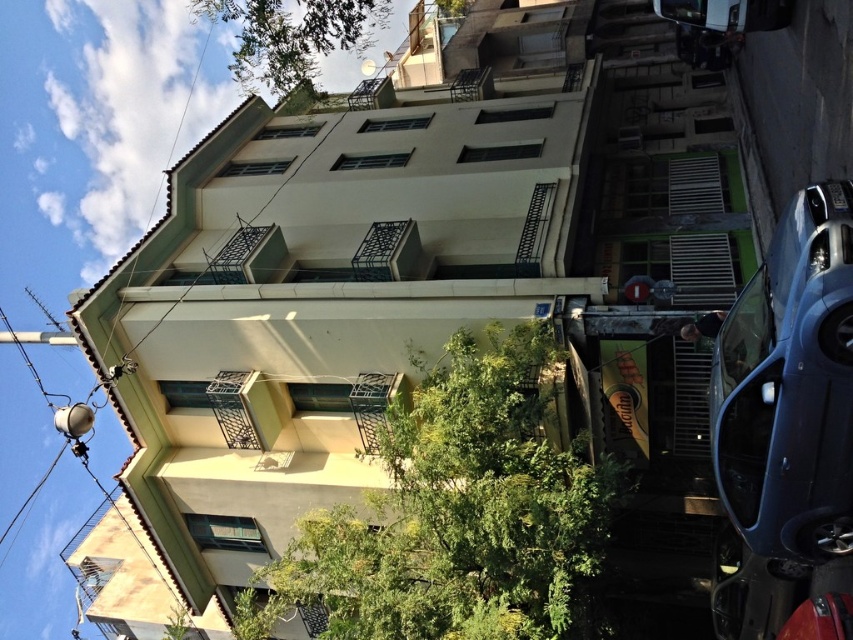
Is point (405, 412) in front of point (766, 413)?

No, (405, 412) is behind (766, 413).

Does green leafy tree at center have a smaller size compared to metallic blue sedan at right?

Indeed, green leafy tree at center has a smaller size compared to metallic blue sedan at right.

Where is `green leafy tree at center`? The image size is (853, 640). green leafy tree at center is located at coordinates (456, 512).

Can you confirm if metallic blue sedan at right is bigger than green leafy tree at upper center?

Incorrect, metallic blue sedan at right is not larger than green leafy tree at upper center.

At what (x,y) coordinates should I click in order to perform the action: click on metallic blue sedan at right. Please return your answer as a coordinate pair (x, y). This screenshot has width=853, height=640. Looking at the image, I should click on (788, 429).

Which is behind, point (809, 604) or point (293, 72)?

Point (293, 72)

Where is `metallic blue sedan at right`? The image size is (853, 640). metallic blue sedan at right is located at coordinates (788, 429).

Between green leafy tree at center and green leafy tree at upper center, which one appears on the right side from the viewer's perspective?

green leafy tree at center is more to the right.

Between green leafy tree at center and green leafy tree at upper center, which one appears on the left side from the viewer's perspective?

green leafy tree at upper center is more to the left.

Does point (500, 592) come closer to viewer compared to point (343, 12)?

Yes, point (500, 592) is closer to viewer.

What are the coordinates of `green leafy tree at center` in the screenshot? It's located at (456, 512).